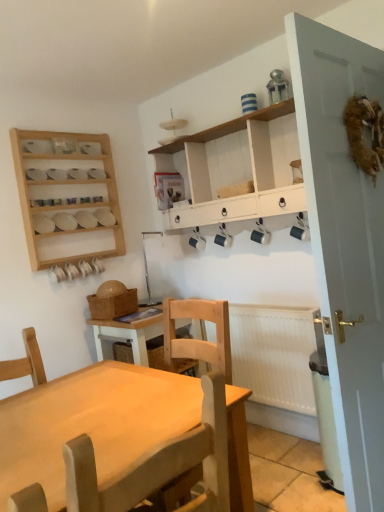
Question: Is white painted wood cabinet at upper center bigger or smaller than white matte radiator at lower right?

Choices:
 (A) big
 (B) small

Answer: (A)

Question: Is point (281, 193) closer or farther from the camera than point (266, 373)?

Choices:
 (A) closer
 (B) farther

Answer: (A)

Question: Based on their relative distances, which object is farther from the white painted door at right?

Choices:
 (A) white matte radiator at lower right
 (B) light brown wooden chair at center
 (C) white painted wood cabinet at upper center
 (D) wooden spice rack at upper left

Answer: (D)

Question: Considering the real-world distances, which object is farthest from the wooden spice rack at upper left?

Choices:
 (A) white painted wood cabinet at upper center
 (B) white painted door at right
 (C) white matte radiator at lower right
 (D) light brown wooden chair at center

Answer: (D)